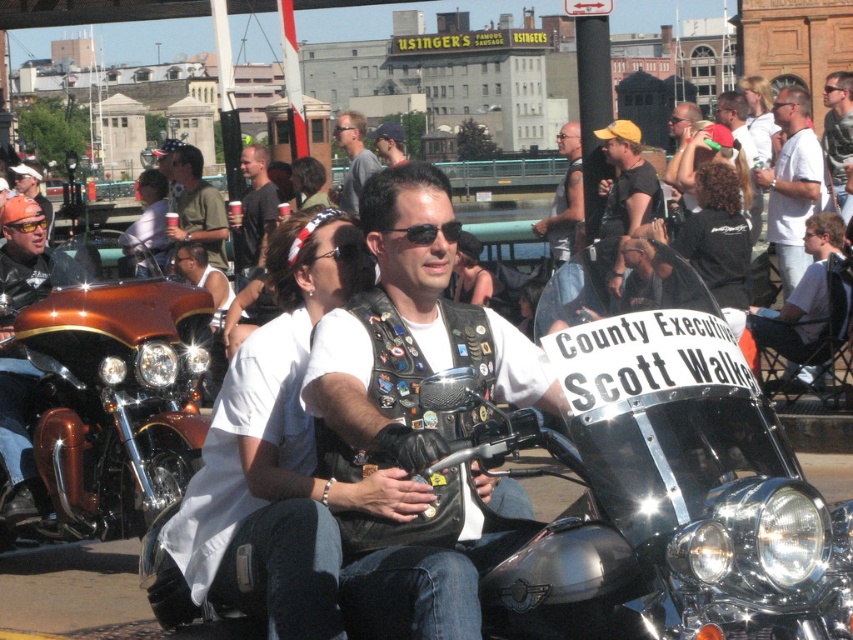
You are a photographer at the event and want to capture a photo that includes both the white fabric shirt at center and the brushed metal goggles at upper center. Based on their positions, will the goggles appear above or below the shirt in the photo?

The white fabric shirt at center is below brushed metal goggles at upper center, so the goggles will appear above the shirt in the photo.

You are a photographer trying to capture a clear shot of the shiny copper motorcycle at left and the matte black sunglasses at center. Since you want to ensure both are in focus, you need to know which object is taller. Can you determine which one is shorter so you can adjust your camera settings accordingly?

The shiny copper motorcycle at left is not as tall as matte black sunglasses at center, so the motorcycle is shorter. Adjust your camera settings to focus on the shorter shiny copper motorcycle at left first.